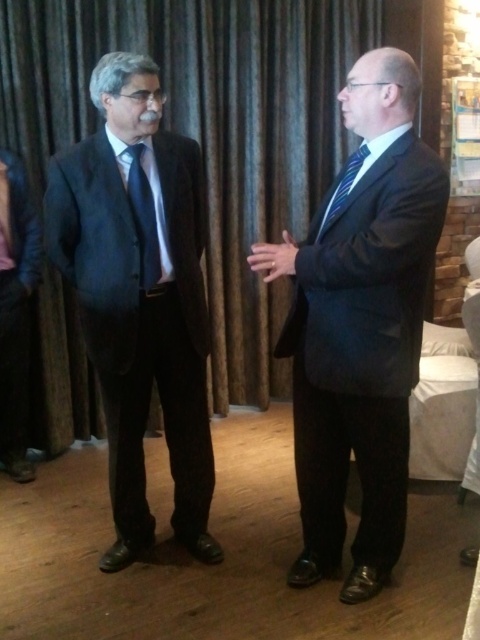
You are a photographer setting up for an event. You notice the brown textured curtain at upper center and the matte black suit at center. Which object is taller in the image?

The brown textured curtain at upper center is taller than the matte black suit at center according to the description.

You are a photographer setting up for a formal event. You need to position a spotlight so that it illuminates both the matte black suit at center and the blue striped tie at right without casting shadows on the dark curtain. Based on their positions, where should you place the spotlight relative to the subjects?

The matte black suit at center is below the blue striped tie at right, so placing the spotlight above and slightly to the right of the blue striped tie at right would ensure both are illuminated while avoiding shadows on the dark curtain.

You are planning to hang a painting that is 2 meters wide on the wall where the brown textured curtain at upper center is located. Considering the size of the dark blue suit at left, will there be enough space to hang the painting without overlapping the suit?

The brown textured curtain at upper center is wider than the dark blue suit at left, so there should be enough space to hang the 2 meter wide painting without overlapping the suit.